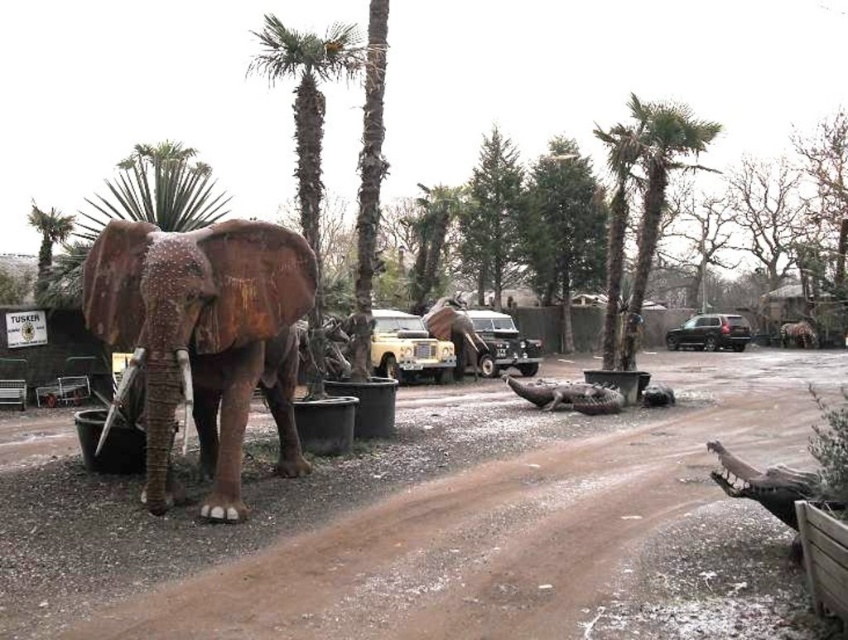
Question: Can you confirm if green leafy palm tree at upper center is positioned to the right of green leafy palm tree at upper left?

Choices:
 (A) yes
 (B) no

Answer: (A)

Question: Can you confirm if green leafy palm tree at upper center is wider than green leafy palm tree at center?

Choices:
 (A) yes
 (B) no

Answer: (B)

Question: Is rusty brown elephant at left closer to the viewer compared to green leafy palm tree at center?

Choices:
 (A) no
 (B) yes

Answer: (B)

Question: Among these objects, which one is nearest to the camera?

Choices:
 (A) green leafy palm tree at upper center
 (B) brown dirt track at center
 (C) green leafy palm tree at upper left

Answer: (B)

Question: Among these objects, which one is nearest to the camera?

Choices:
 (A) green leafy palm tree at upper center
 (B) rusty brown elephant at left
 (C) green leafy palm tree at center
 (D) green leafy palm tree at upper left

Answer: (B)

Question: Considering the real-world distances, which object is closest to the rusty brown elephant at left?

Choices:
 (A) green leafy palm tree at upper left
 (B) brown dirt track at center
 (C) green leafy palm tree at upper center
 (D) green leafy palm tree at center

Answer: (B)